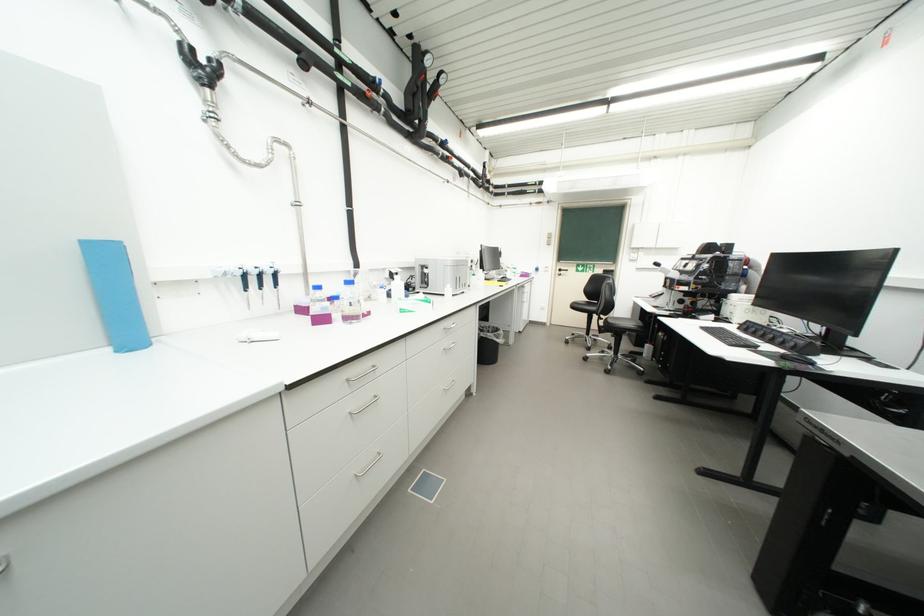
What do you see at coordinates (622, 323) in the screenshot? I see `the chair sitting surface` at bounding box center [622, 323].